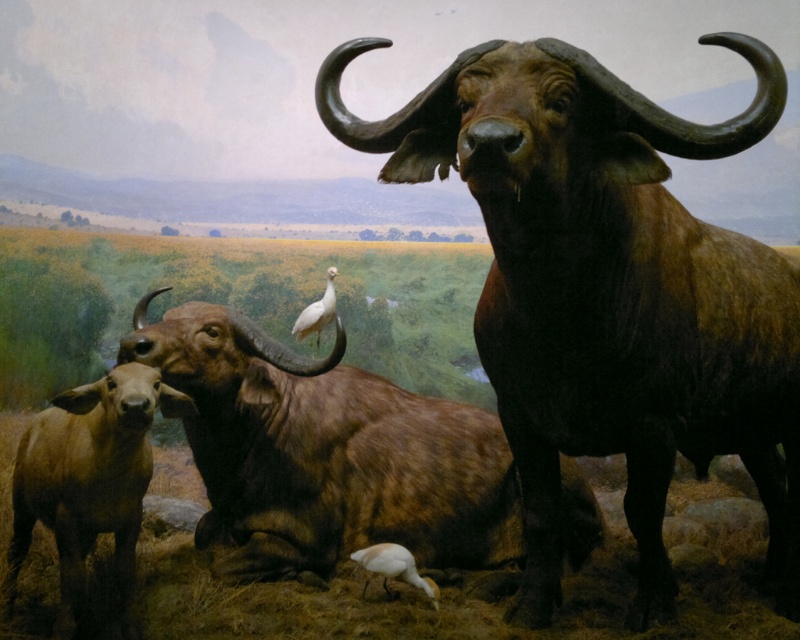
Question: Is shiny brown yak at center to the right of white matte bird at center from the viewer's perspective?

Choices:
 (A) no
 (B) yes

Answer: (B)

Question: Which object is positioned farthest from the shiny brown yak at center?

Choices:
 (A) brown matte yak at center
 (B) white matte bird at center
 (C) white matte bird at lower center

Answer: (B)

Question: Can you confirm if shiny brown yak at center is wider than brown matte yak at center?

Choices:
 (A) yes
 (B) no

Answer: (B)

Question: Is shiny brown yak at center thinner than white matte bird at center?

Choices:
 (A) no
 (B) yes

Answer: (A)

Question: Which point is closer to the camera?

Choices:
 (A) (414, 579)
 (B) (360, 522)
 (C) (338, 77)
 (D) (296, 333)

Answer: (C)

Question: Estimate the real-world distances between objects in this image. Which object is farther from the brown matte yak at center?

Choices:
 (A) white matte bird at lower center
 (B) shiny brown yak at center

Answer: (B)